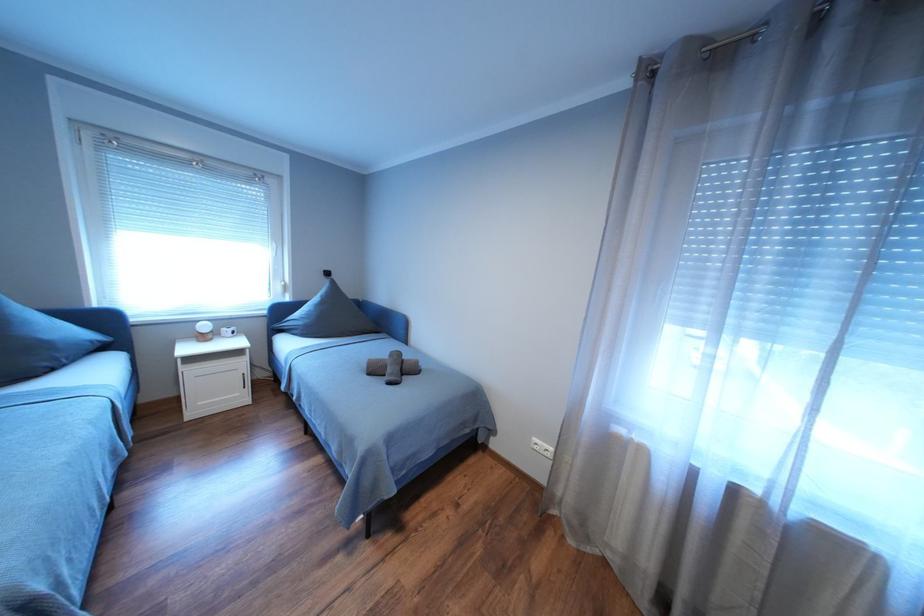
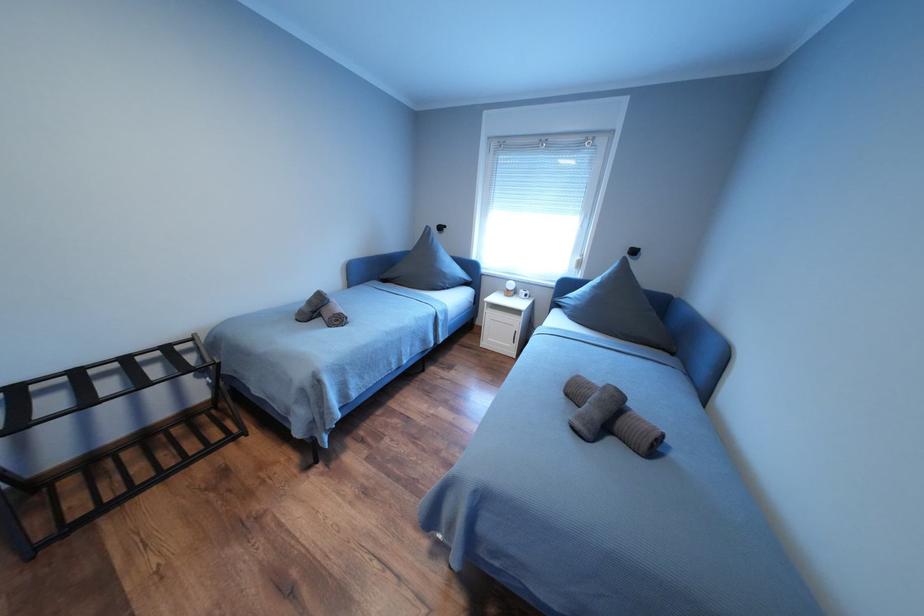
Question: The camera is either moving clockwise (left) or counter-clockwise (right) around the object. The first image is from the beginning of the video and the second image is from the end. Is the camera moving left or right when shooting the video?

Choices:
 (A) Left
 (B) Right

Answer: (B)